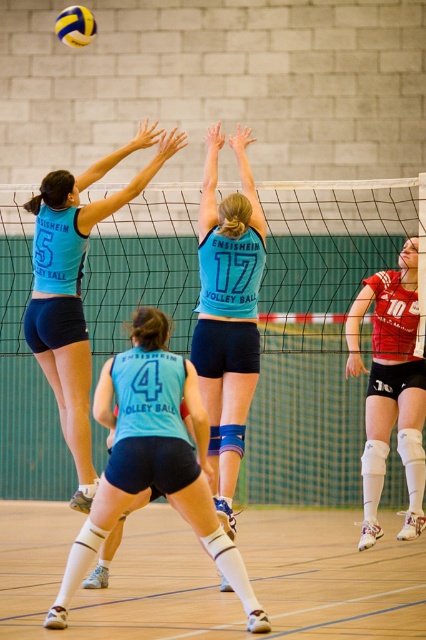
Does teal jersey at center lie behind yellow/yellowish matte/volleyball at upper left?

No, teal jersey at center is closer to the viewer.

Based on the photo, can you confirm if teal jersey at center is positioned to the left of yellow/yellowish matte/volleyball at upper left?

Incorrect, teal jersey at center is not on the left side of yellow/yellowish matte/volleyball at upper left.

Who is more distant from viewer, (x=138, y=310) or (x=77, y=4)?

Point (x=77, y=4)

Find the location of a particular element. The image size is (426, 640). teal jersey at center is located at coordinates (152, 460).

Is point (397, 364) in front of point (66, 17)?

That is False.

Does red jersey knee pads at right have a lesser width compared to yellow/yellowish matte/volleyball at upper left?

No.

The image size is (426, 640). What do you see at coordinates (391, 388) in the screenshot?
I see `red jersey knee pads at right` at bounding box center [391, 388].

What are the coordinates of `red jersey knee pads at right` in the screenshot? It's located at (391, 388).

Is matte blue jersey at center to the right of yellow/yellowish matte/volleyball at upper left from the viewer's perspective?

Yes, matte blue jersey at center is to the right of yellow/yellowish matte/volleyball at upper left.

Is point (241, 385) farther from viewer compared to point (81, 29)?

No, (241, 385) is in front of (81, 29).

Is point (249, 289) behind point (89, 29)?

No.

The image size is (426, 640). What are the coordinates of `matte blue jersey at center` in the screenshot? It's located at (227, 312).